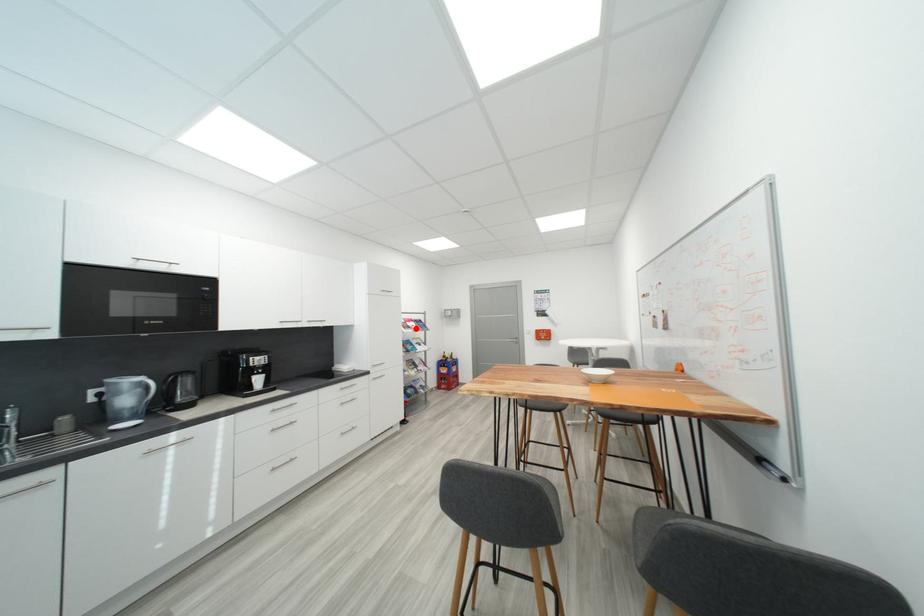
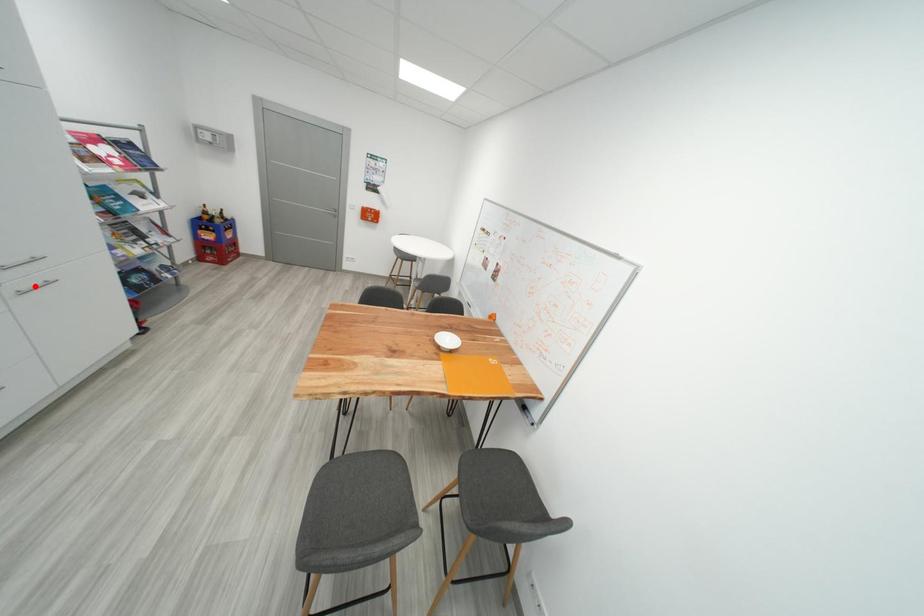
I am providing you with two images of the same scene from different viewpoints. A red point is marked on the first image and another point is marked on the second image. Do the highlighted points in image1 and image2 indicate the same real-world spot?

No